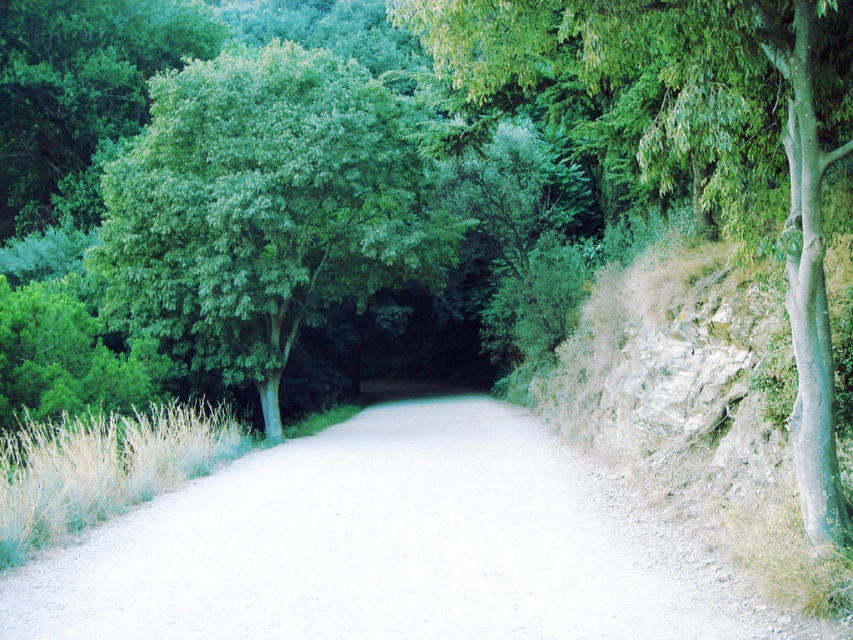
You are a hiker planning to walk along the gray gravel path at center. You notice the green leafy tree at center nearby. Which object takes up more space in the scene?

The green leafy tree at center takes up more space in the scene than the gray gravel path at center.

You are standing at the point with coordinates 0.5, 0.5 in the image. Which direction should you move to reach the green leafy tree at center?

Since the green leafy tree at center is located at point (263,209) and you are at (426,320), you should move towards the lower left direction to reach it.

You are standing at the viewer position in the forest scene. There is a point at coordinates point (521, 627). If you want to place a 3 meter long wooden bench along the path, can you fit it between the point and your current position?

The distance between the point (521, 627) and the viewer is 5.92 meters. Since the bench is 3 meters long, there is enough space to place it between the point and your current position.